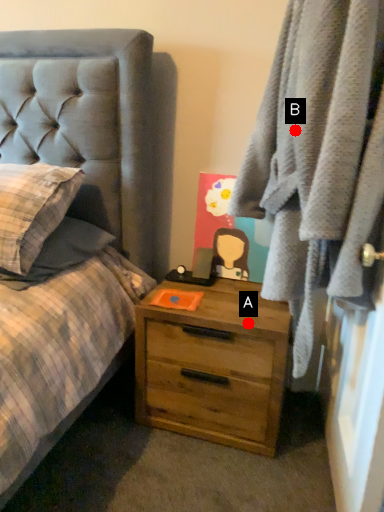
Question: Two points are circled on the image, labeled by A and B beside each circle. Which point is closer to the camera?

Choices:
 (A) A is closer
 (B) B is closer

Answer: (B)